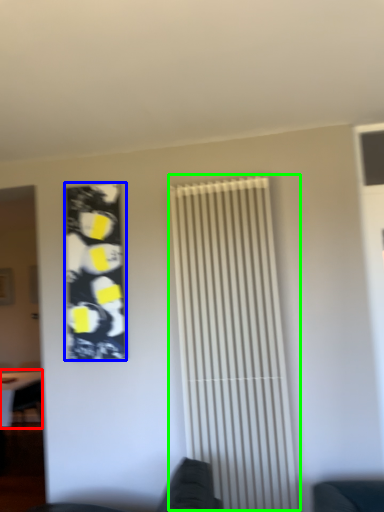
Question: Which object is the farthest from table (highlighted by a red box)? Choose among these: poster (highlighted by a blue box) or shutter (highlighted by a green box).

Choices:
 (A) poster
 (B) shutter

Answer: (B)